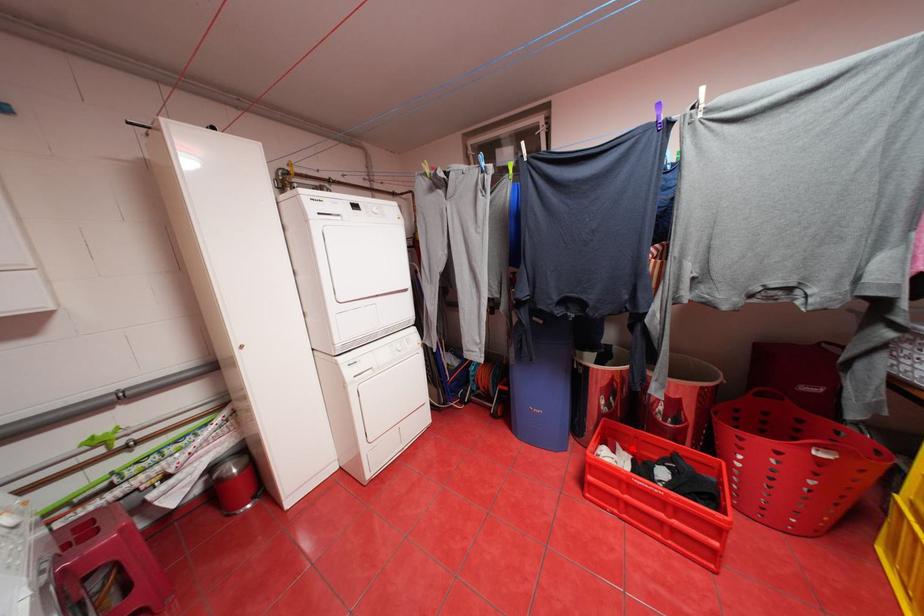
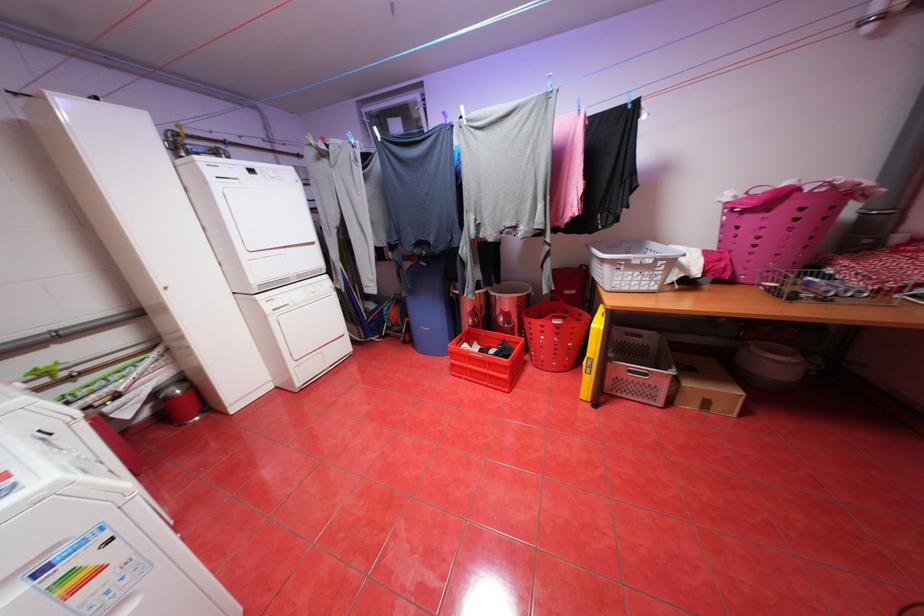
Question: I am providing you with two images of the same scene from different viewpoints. Given a red point in image1, look at the same physical point in image2. Is it:

Choices:
 (A) Closer to the viewpoint
 (B) Farther from the viewpoint

Answer: (A)